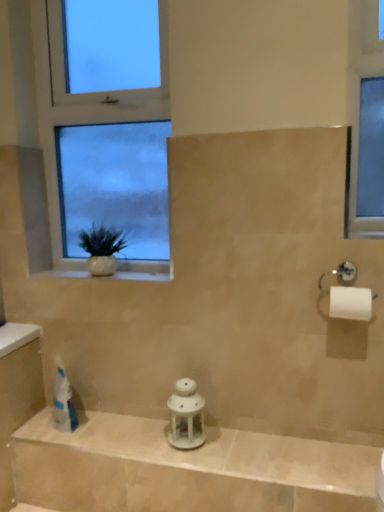
Question: From a real-world perspective, relative to white glossy lantern at center, is white glass window at upper left vertically above or below?

Choices:
 (A) above
 (B) below

Answer: (A)

Question: Looking at their shapes, would you say white glass window at upper left is wider or thinner than white glossy lantern at center?

Choices:
 (A) wide
 (B) thin

Answer: (B)

Question: Based on their relative distances, which object is nearer to the white matte toilet paper at right?

Choices:
 (A) white ceramic vase at left
 (B) white glass window at upper left
 (C) white glossy lantern at center
 (D) white ceramic vase at left
 (E) white porcelain lantern at center

Answer: (E)

Question: Based on their relative distances, which object is nearer to the white matte toilet paper at right?

Choices:
 (A) white porcelain lantern at center
 (B) white ceramic vase at left
 (C) white glass window at upper left
 (D) white glossy lantern at center
 (E) white ceramic vase at left

Answer: (A)